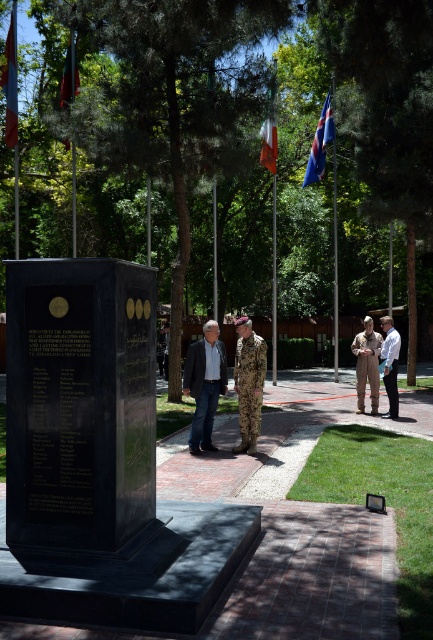
Which of these two, dark blue jeans at center or green fabric flag at upper left, stands shorter?

With less height is dark blue jeans at center.

Does point (219, 348) lie in front of point (74, 77)?

Yes, point (219, 348) is closer to viewer.

Does point (204, 358) lie behind point (70, 65)?

No, (204, 358) is closer to viewer.

I want to click on dark blue jeans at center, so click(204, 385).

From the picture: Does dark blue jeans at center appear on the left side of camouflage uniform at center?

Indeed, dark blue jeans at center is positioned on the left side of camouflage uniform at center.

Is dark blue jeans at center below camouflage uniform at center?

No.

The height and width of the screenshot is (640, 433). Describe the element at coordinates (204, 385) in the screenshot. I see `dark blue jeans at center` at that location.

You are a GUI agent. You are given a task and a screenshot of the screen. Output one action in this format:
    pyautogui.click(x=<x>, y=<y>)
    Task: Click on the dark blue jeans at center
    
    Given the screenshot: What is the action you would take?
    pyautogui.click(x=204, y=385)

Which of these two, green fabric flag at upper left or orange fabric flag at upper center, stands shorter?

Standing shorter between the two is orange fabric flag at upper center.

Who is more distant from viewer, (x=67, y=148) or (x=271, y=148)?

The point (x=67, y=148) is behind.

Is point (64, 140) positioned before point (262, 150)?

Yes, point (64, 140) is closer to viewer.

Find the location of a particular element. Image resolution: width=433 pixels, height=640 pixels. green fabric flag at upper left is located at coordinates (70, 74).